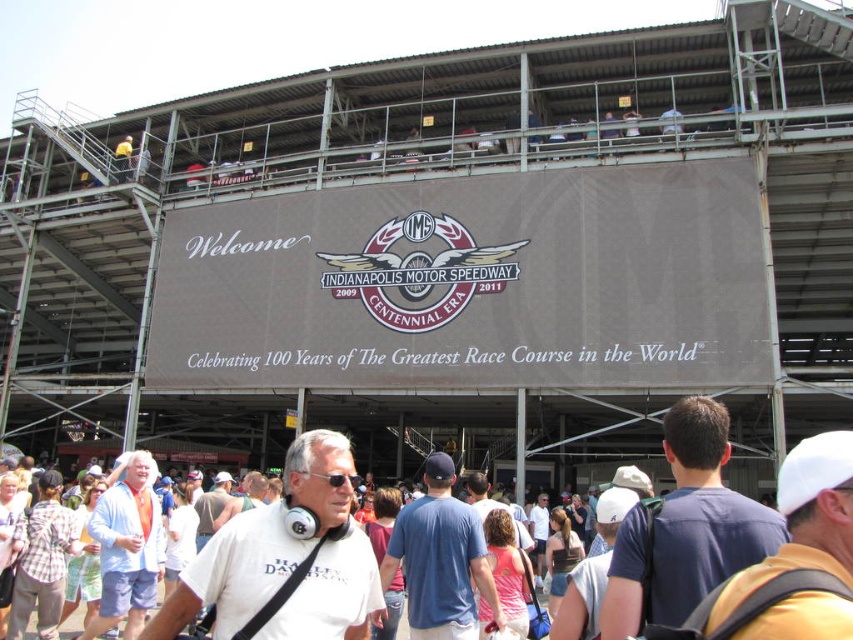
Can you confirm if dark blue t-shirt at center is positioned to the left of orange-cotton shirt at lower left?

No, dark blue t-shirt at center is not to the left of orange-cotton shirt at lower left.

Can you confirm if dark blue t-shirt at center is bigger than orange-cotton shirt at lower left?

Correct, dark blue t-shirt at center is larger in size than orange-cotton shirt at lower left.

This screenshot has height=640, width=853. I want to click on dark blue t-shirt at center, so click(685, 529).

Where is `dark blue t-shirt at center`? Image resolution: width=853 pixels, height=640 pixels. dark blue t-shirt at center is located at coordinates (685, 529).

Measure the distance between dark blue t-shirt at center and black matte sunglasses at center.

dark blue t-shirt at center and black matte sunglasses at center are 10.02 meters apart.

What do you see at coordinates (685, 529) in the screenshot? I see `dark blue t-shirt at center` at bounding box center [685, 529].

Locate an element on the screen. The width and height of the screenshot is (853, 640). dark blue t-shirt at center is located at coordinates (685, 529).

Does white matte baseball cap at upper right have a smaller size compared to blue cotton shirt at center?

Incorrect, white matte baseball cap at upper right is not smaller in size than blue cotton shirt at center.

Measure the distance between white matte baseball cap at upper right and blue cotton shirt at center.

white matte baseball cap at upper right and blue cotton shirt at center are 47.48 feet apart.

Which is behind, point (833, 458) or point (440, 520)?

Positioned behind is point (440, 520).

Where is `white matte baseball cap at upper right`? white matte baseball cap at upper right is located at coordinates (801, 522).